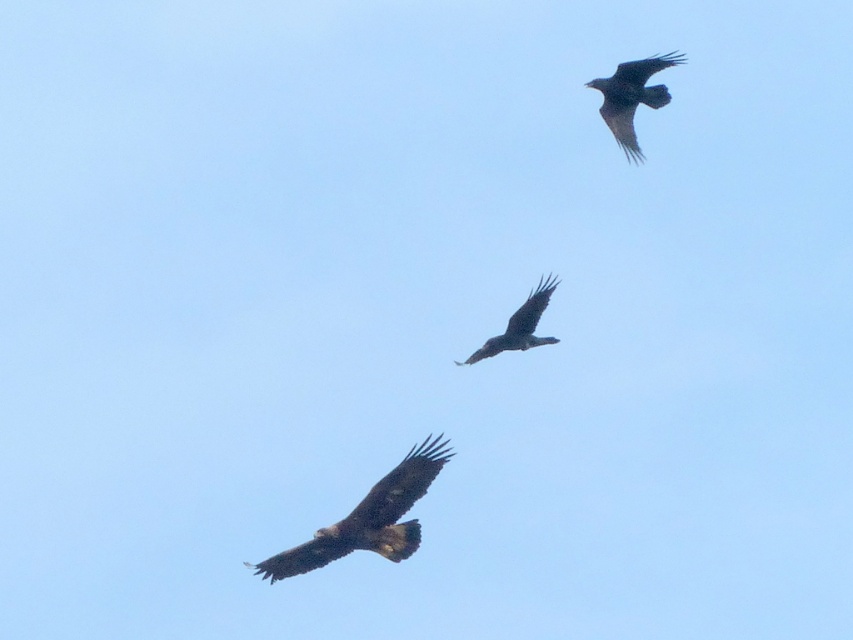
Question: Which of the following is the closest to the observer?

Choices:
 (A) (390, 499)
 (B) (640, 90)
 (C) (527, 321)

Answer: (A)

Question: Which object is farther from the camera taking this photo?

Choices:
 (A) brown feathered eagle at lower center
 (B) dark brown feathers at center
 (C) dark brown feathers at upper right

Answer: (C)

Question: Is brown feathered eagle at lower center below dark brown feathers at center?

Choices:
 (A) yes
 (B) no

Answer: (A)

Question: Can you confirm if brown feathered eagle at lower center is positioned to the right of dark brown feathers at center?

Choices:
 (A) no
 (B) yes

Answer: (A)

Question: Which point is farther to the camera?

Choices:
 (A) (310, 545)
 (B) (672, 52)
 (C) (503, 339)

Answer: (B)

Question: Can you confirm if dark brown feathers at upper right is thinner than dark brown feathers at center?

Choices:
 (A) yes
 (B) no

Answer: (B)